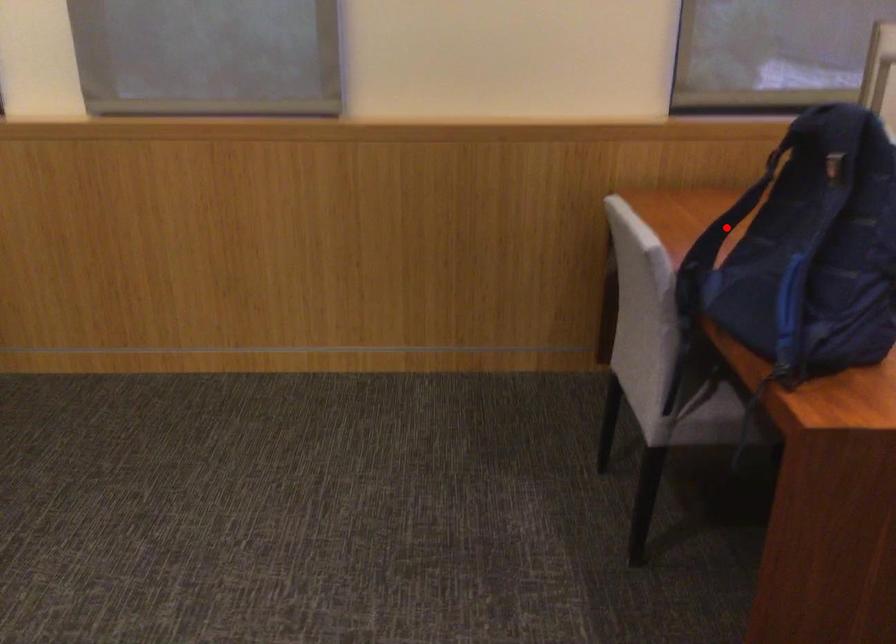
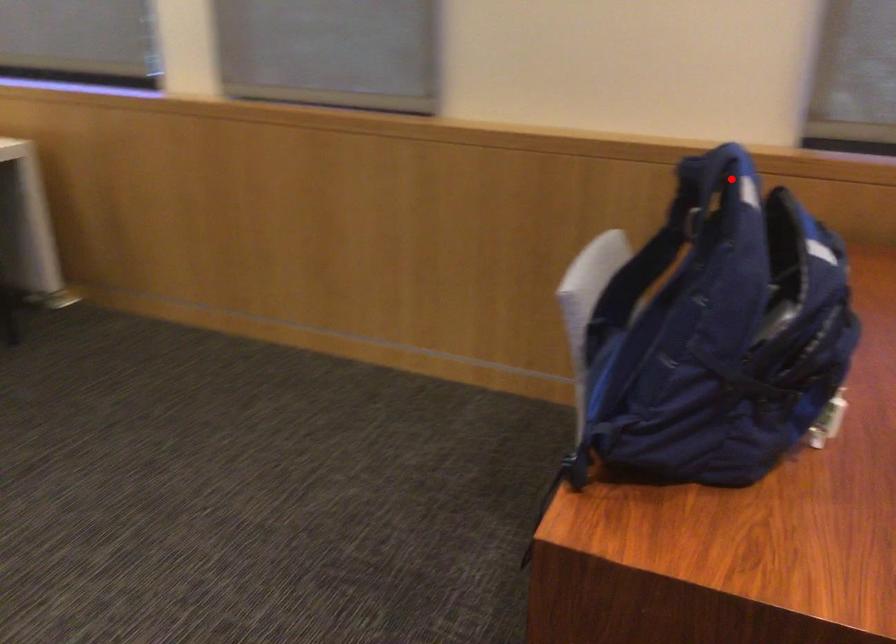
I am providing you with two images of the same scene from different viewpoints. A red point is marked on the first image and another point is marked on the second image. Are the points marked in image1 and image2 representing the same 3D position?

No